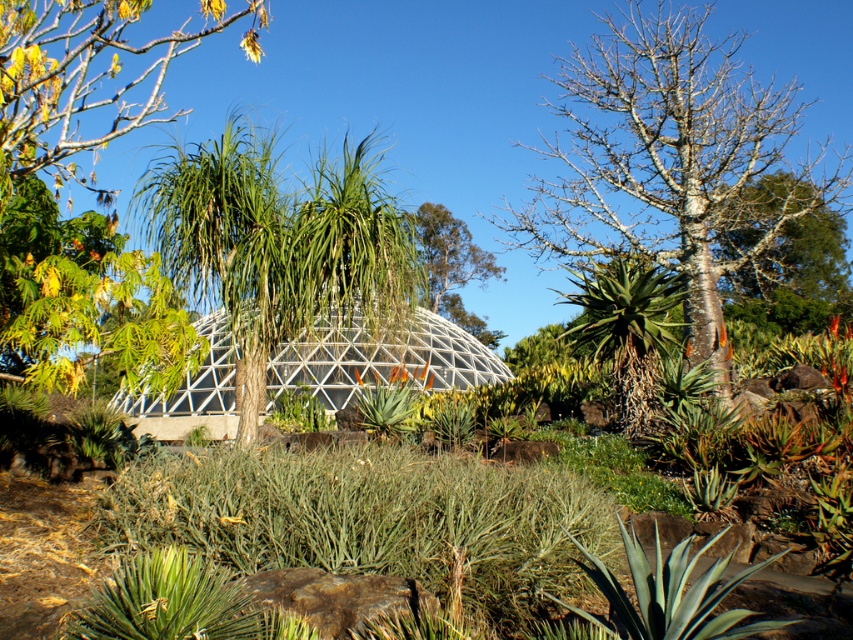
Question: Is bark textured tree at right positioned before smooth bark tree at upper right?

Choices:
 (A) no
 (B) yes

Answer: (B)

Question: Which object is closer to the camera taking this photo?

Choices:
 (A) green leafy tree at left
 (B) green leafy tree at center
 (C) transparent glass dome at center

Answer: (A)

Question: Based on their relative distances, which object is farther from the green leafy tree at center?

Choices:
 (A) bark textured tree at right
 (B) transparent glass dome at center

Answer: (A)

Question: Is transparent glass dome at center behind smooth bark tree at upper right?

Choices:
 (A) no
 (B) yes

Answer: (A)

Question: Can you confirm if bark textured tree at right is thinner than green leafy tree at center?

Choices:
 (A) yes
 (B) no

Answer: (B)

Question: Among these objects, which one is nearest to the camera?

Choices:
 (A) green leafy tree at left
 (B) transparent glass dome at center

Answer: (A)